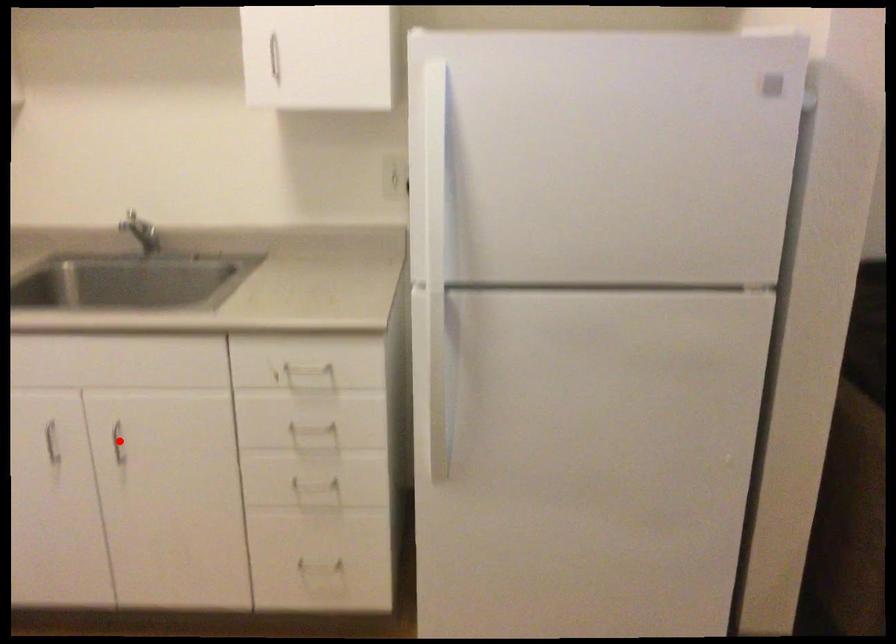
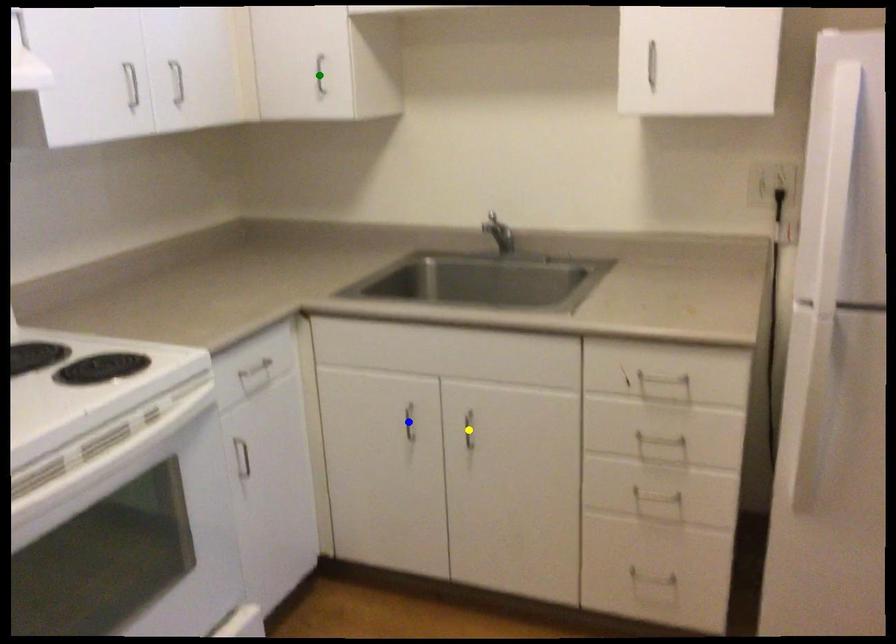
Question: I am providing you with two images of the same scene from different viewpoints. A red point is marked on the first image. You are given multiple points on the second image. Which point in image 2 is actually the same real-world point as the red point in image 1?

Choices:
 (A) yellow point
 (B) blue point
 (C) green point

Answer: (A)